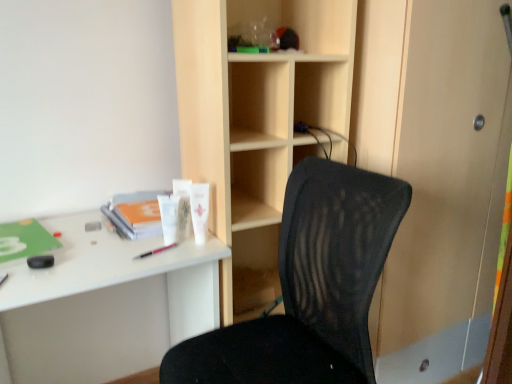
I want to click on vacant space to the left of pink plastic pen at center, which ranks as the first stationery in bottom-to-top order, so click(96, 255).